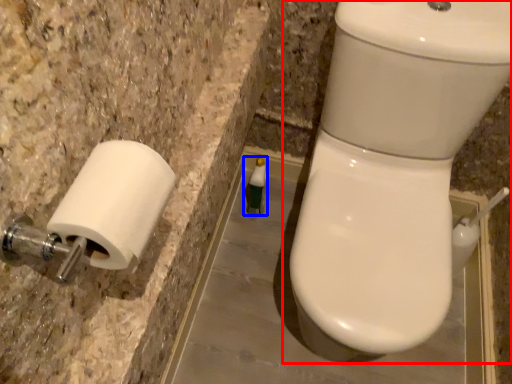
Question: Which point is closer to the camera, toilet (highlighted by a red box) or toiletry (highlighted by a blue box)?

Choices:
 (A) toilet
 (B) toiletry

Answer: (A)